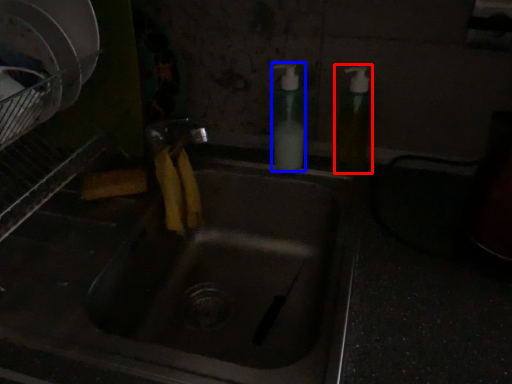
Question: Which point is closer to the camera, soap dispenser (highlighted by a red box) or soap dispenser (highlighted by a blue box)?

Choices:
 (A) soap dispenser
 (B) soap dispenser

Answer: (A)